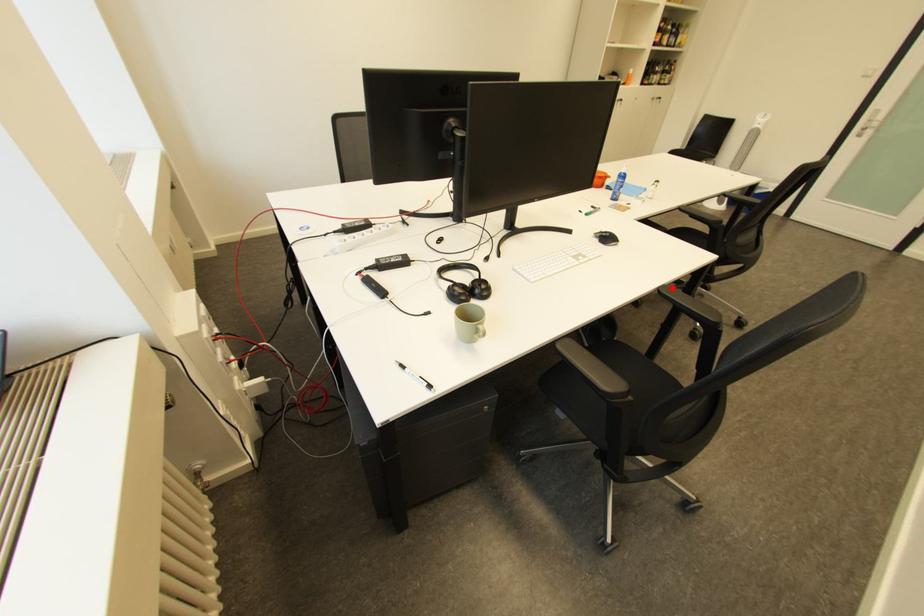
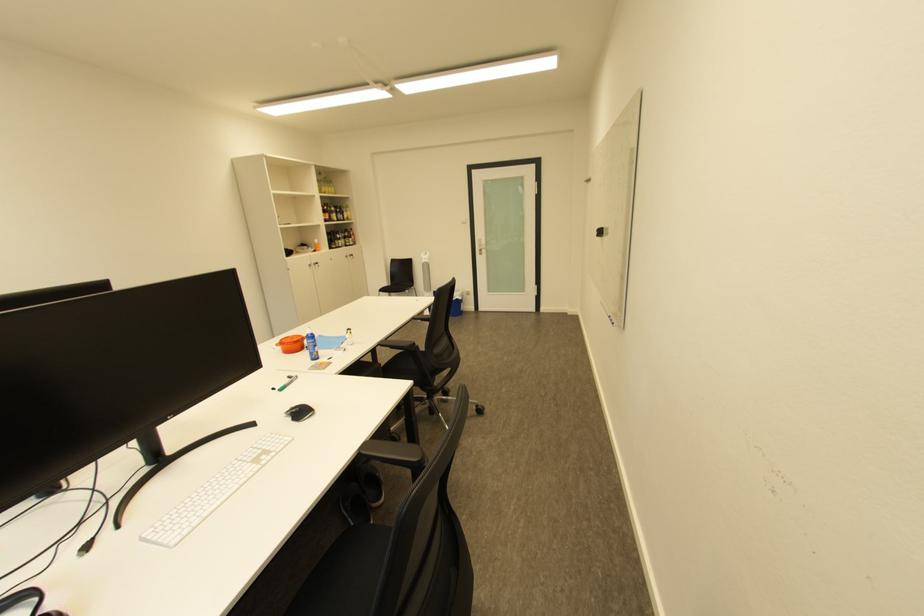
The point at the highlighted location is marked in the first image. Where is the corresponding point in the second image?

(373, 446)